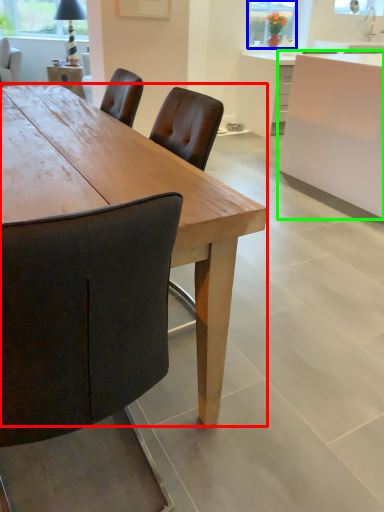
Question: Estimate the real-world distances between objects in this image. Which object is closer to desk (highlighted by a red box), window screen (highlighted by a blue box) or cabinetry (highlighted by a green box)?

Choices:
 (A) window screen
 (B) cabinetry

Answer: (B)